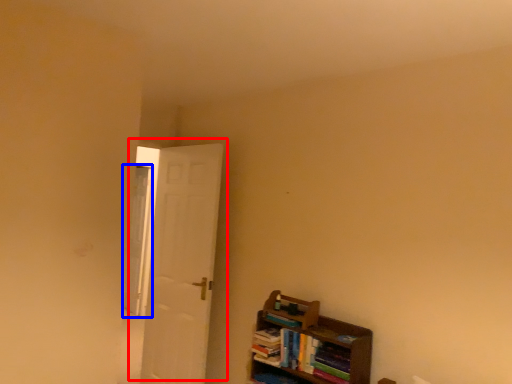
Question: Which of the following is the farthest to the observer, door (highlighted by a red box) or window (highlighted by a blue box)?

Choices:
 (A) door
 (B) window

Answer: (B)